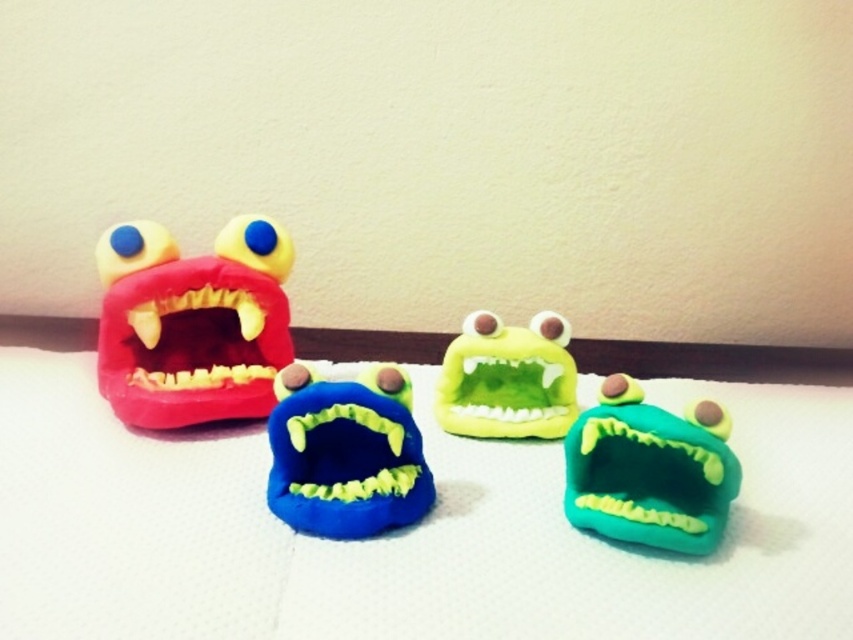
You are a child who wants to place a new toy between the green matte toy at center and the green matte plush toy at center. The new toy is 25 centimeters wide. Can you fit it between them?

The distance between the green matte toy at center and the green matte plush toy at center is 20.25 centimeters. Since the new toy is 25 centimeters wide, it cannot fit in the space provided.

You are a child who wants to place a new toy between the blue fuzzy monster at center and the green matte plush toy at center. The new toy is 4 inches wide. Can the new toy fit between them?

The blue fuzzy monster at center is 8.66 inches from the green matte plush toy at center. Since the new toy is 4 inches wide, it can fit between them as there is enough space.

You are standing at the center of the white surface and looking towards the beige wall. There are two points marked on the surface. Can you tell me which point, point 1 at coordinates (547, 330) or point 2 at coordinates (247, 333), is closer to the wall?

Point 1 at coordinates (547, 330) is behind point 2 at coordinates (247, 333), so point 1 at coordinates (547, 330) is closer to the wall.